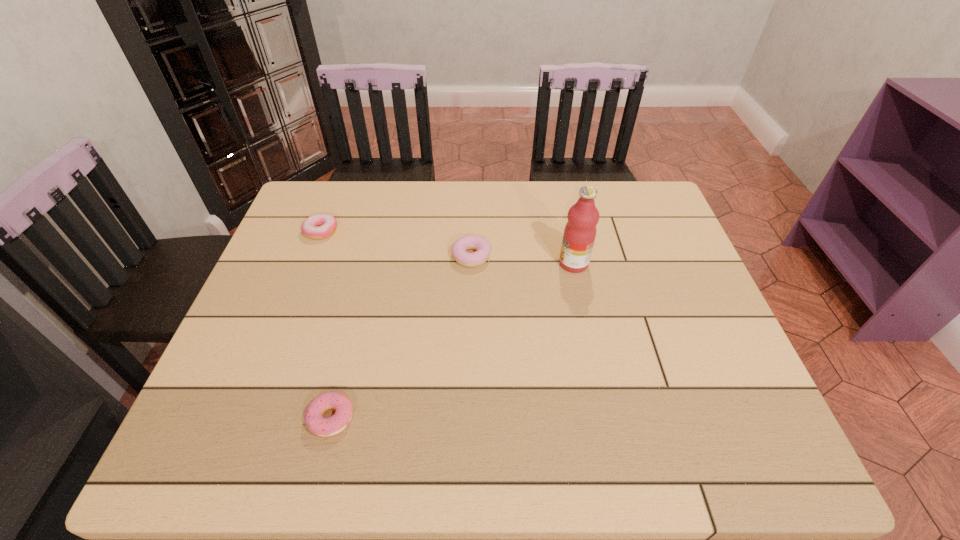
Where is `vacant point located 0.390m on the label of the tallest object`? Image resolution: width=960 pixels, height=540 pixels. vacant point located 0.390m on the label of the tallest object is located at coordinates click(415, 264).

What are the coordinates of `vacant region located 0.380m on the front of the second farthest doughnut` in the screenshot? It's located at (468, 400).

Where is `vacant space located 0.300m on the right of the leftmost doughnut`? vacant space located 0.300m on the right of the leftmost doughnut is located at coordinates (441, 231).

At what (x,y) coordinates should I click in order to perform the action: click on vacant space located 0.110m on the left of the second doughnut from right to left. Please return your answer as a coordinate pair (x, y). This screenshot has width=960, height=540. Looking at the image, I should click on (253, 418).

Locate an element on the screen. This screenshot has width=960, height=540. object located in the far edge section of the desktop is located at coordinates (318, 226).

At what (x,y) coordinates should I click in order to perform the action: click on object at the near edge. Please return your answer as a coordinate pair (x, y). Looking at the image, I should click on (324, 427).

At what (x,y) coordinates should I click in order to perform the action: click on object that is at the left edge. Please return your answer as a coordinate pair (x, y). The width and height of the screenshot is (960, 540). Looking at the image, I should click on (318, 226).

Locate an element on the screen. The width and height of the screenshot is (960, 540). object located at the far left corner is located at coordinates (318, 226).

This screenshot has width=960, height=540. In the image, there is a desktop. Identify the location of vacant space at the far edge. (394, 185).

At what (x,y) coordinates should I click in order to perform the action: click on free space at the near edge of the desktop. Please return your answer as a coordinate pair (x, y). The width and height of the screenshot is (960, 540). Looking at the image, I should click on (516, 426).